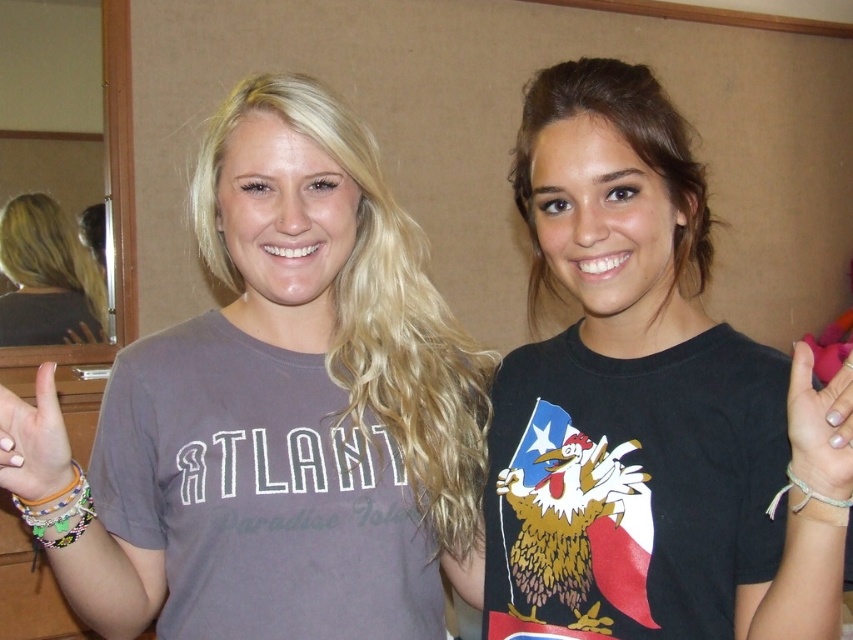
Question: Does matte gray t-shirt at center lie in front of white string bracelet at right?

Choices:
 (A) yes
 (B) no

Answer: (B)

Question: Which point is farther to the camera?

Choices:
 (A) (413, 291)
 (B) (813, 449)
 (C) (28, 502)

Answer: (A)

Question: Which point is closer to the camera taking this photo?

Choices:
 (A) (798, 432)
 (B) (54, 200)

Answer: (A)

Question: In this image, where is blonde hair at left located relative to matte orange nail polish at center?

Choices:
 (A) left
 (B) right

Answer: (A)

Question: From the image, what is the correct spatial relationship of blonde hair at left in relation to matte orange nail polish at center?

Choices:
 (A) right
 (B) left

Answer: (B)

Question: Which of these objects is positioned closest to the black matte t-shirt at center?

Choices:
 (A) matte orange nail polish at center
 (B) matte gray t-shirt at center
 (C) white string bracelet at right
 (D) blonde hair at left

Answer: (C)